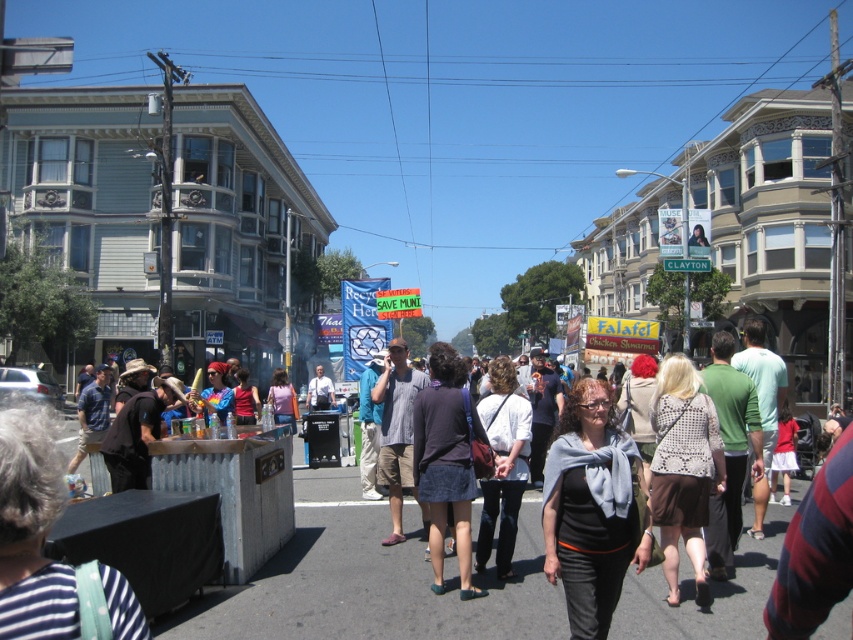
Question: Where is dark blue denim skirt at center located in relation to light blue shirt at center in the image?

Choices:
 (A) right
 (B) left

Answer: (A)

Question: Which of the following is the closest to the observer?

Choices:
 (A) gray scarf at center
 (B) black cotton shirt at center
 (C) light blue shirt at center
 (D) dark blue denim skirt at center

Answer: (A)

Question: Among these objects, which one is nearest to the camera?

Choices:
 (A) black cotton shirt at center
 (B) light blue shirt at center
 (C) dark blue denim skirt at center
 (D) gray scarf at center

Answer: (D)

Question: Which object appears closest to the camera in this image?

Choices:
 (A) black cotton shirt at center
 (B) gray scarf at center
 (C) light blue shirt at center
 (D) dark blue denim skirt at center

Answer: (B)

Question: Is dark blue denim skirt at center thinner than light blue shirt at center?

Choices:
 (A) yes
 (B) no

Answer: (A)

Question: Does black cotton shirt at center have a greater width compared to dark blue denim skirt at center?

Choices:
 (A) no
 (B) yes

Answer: (B)